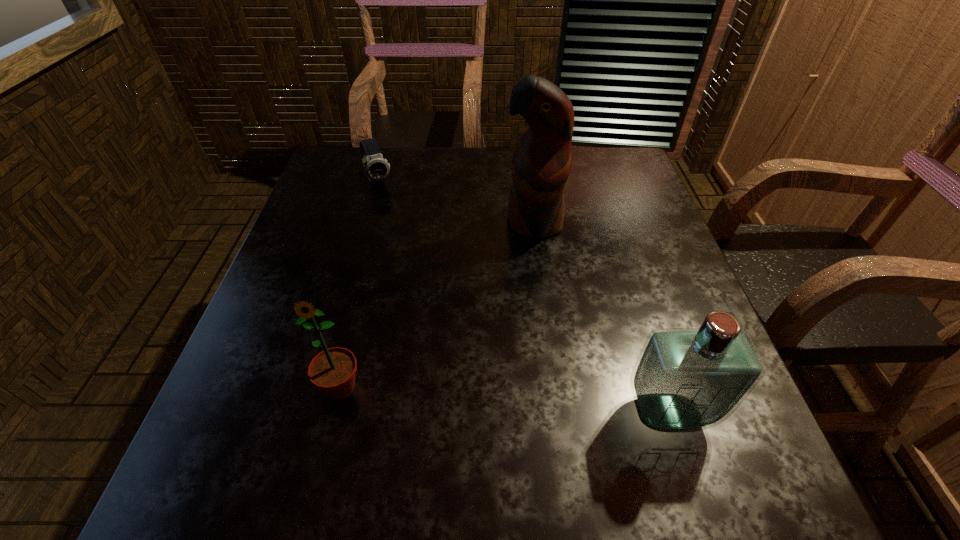
Where is `blank region between the watch and the third object from left to right`? This screenshot has height=540, width=960. blank region between the watch and the third object from left to right is located at coordinates pos(456,201).

Locate an element on the screen. This screenshot has height=540, width=960. free spot between the perfume and the third object from left to right is located at coordinates (601, 318).

Identify the location of unoccupied area between the sunflower and the second object from right to left. (437, 305).

You are a GUI agent. You are given a task and a screenshot of the screen. Output one action in this format:
    pyautogui.click(x=<x>, y=<y>)
    Task: Click on the free space that is in between the third object from left to right and the perfume
    This screenshot has height=540, width=960.
    Given the screenshot: What is the action you would take?
    pyautogui.click(x=601, y=318)

At what (x,y) coordinates should I click in order to perform the action: click on vacant space that's between the farthest object and the sunflower. Please return your answer as a coordinate pair (x, y). Looking at the image, I should click on (360, 285).

Find the location of a particular element. This screenshot has height=540, width=960. unoccupied position between the rightmost object and the second farthest object is located at coordinates (601, 318).

Where is `free space between the second object from right to left and the rightmost object`? The width and height of the screenshot is (960, 540). free space between the second object from right to left and the rightmost object is located at coordinates (601, 318).

This screenshot has width=960, height=540. What are the coordinates of `vacant space in between the sunflower and the second object from right to left` in the screenshot? It's located at (437, 305).

Locate which object ranks second in proximity to the watch. Please provide its 2D coordinates. Your answer should be formatted as a tuple, i.e. [(x, y)], where the tuple contains the x and y coordinates of a point satisfying the conditions above.

[(333, 370)]

The image size is (960, 540). In order to click on the second closest object to the sunflower in this screenshot , I will do `click(685, 379)`.